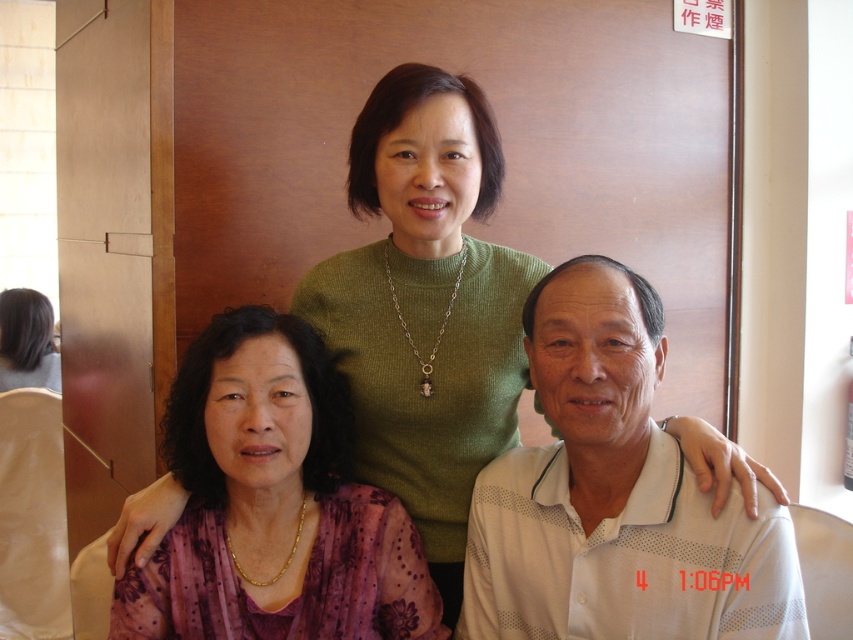
You are a photographer adjusting the lighting in the room for a portrait. You need to ensure that the white textured polo shirt at center and the purple sheer blouse at center are both well lit. Given their positions relative to each other, which one is closer to the light source on the left side of the frame?

The white textured polo shirt at center is above the purple sheer blouse at center, so it is closer to the light source on the left side of the frame and will be better lit.

You are a photographer adjusting the camera to capture the scene. The camera has a maximum focus range of 2 meters. Can you focus on both the purple sheer blouse at center and the matte purple blouse at lower left simultaneously?

The distance between the purple sheer blouse at center and the matte purple blouse at lower left is 2.07 meters. Since the camera can only focus within 2 meters, it cannot capture both subjects clearly at the same time.